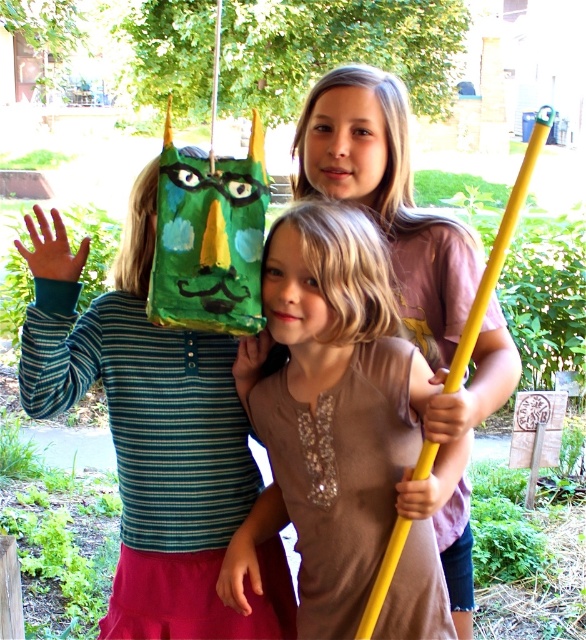
This screenshot has width=586, height=640. Identify the location of matte brown shirt at center. (339, 429).

This screenshot has width=586, height=640. I want to click on matte brown shirt at center, so click(x=339, y=429).

Find the location of a particular element. The width and height of the screenshot is (586, 640). matte brown shirt at center is located at coordinates (339, 429).

Is matte brown shirt at center wider than matte green paper bag at left?

No.

Between matte brown shirt at center and matte green paper bag at left, which one appears on the right side from the viewer's perspective?

From the viewer's perspective, matte brown shirt at center appears more on the right side.

The height and width of the screenshot is (640, 586). In order to click on matte brown shirt at center in this screenshot , I will do `click(339, 429)`.

I want to click on matte green paper bag at left, so click(x=154, y=436).

This screenshot has width=586, height=640. Identify the location of matte green paper bag at left. (154, 436).